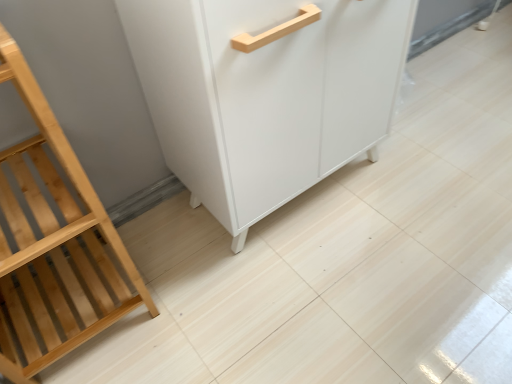
Where is `free area in between white matte cabinet at center and natural wood shelf at left`? This screenshot has width=512, height=384. free area in between white matte cabinet at center and natural wood shelf at left is located at coordinates (178, 259).